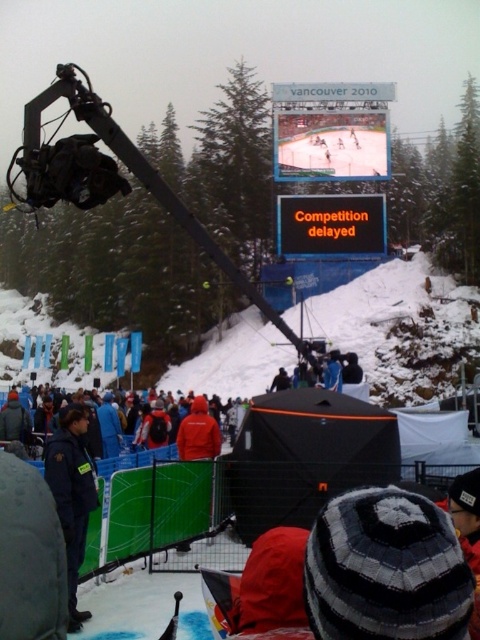
You are standing at the point closer to you in the image. Which point are you at, point [310,211] or point [162,452]?

You are at point [162,452] because it is closer to the viewer than point [310,211].

You are a photographer at the Vancouver 2010 Winter Olympics. You want to take a photo of the red jacket at center without the orange led sign at upper center blocking the view. Can you adjust your position to achieve this?

The orange led sign at upper center is further to the viewer than the red jacket at center, so moving your position slightly to the side or adjusting the angle of your camera could allow you to capture the red jacket at center without the sign blocking it.

You are a photographer trying to capture a photo of the red jacket at center without the orange led sign at upper center appearing in the foreground. Is this possible based on their relative sizes?

The orange led sign at upper center is much taller than the red jacket at center, so it might block the view depending on the angle and distance. Adjust your position to frame the shot so the sign is out of the way.